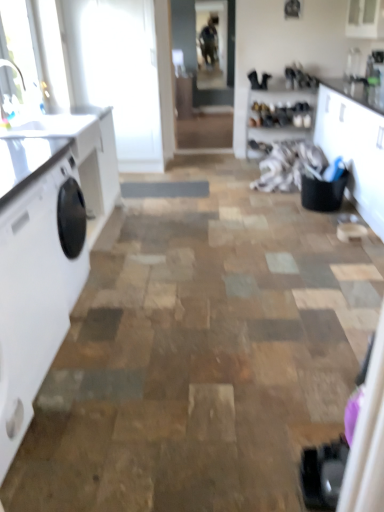
Question: From a real-world perspective, is white glossy countertop at left physically above clear glass window screen at upper center?

Choices:
 (A) yes
 (B) no

Answer: (B)

Question: Would you say clear glass window screen at upper center is part of white glossy countertop at left's contents?

Choices:
 (A) yes
 (B) no

Answer: (B)

Question: Is white glossy countertop at left turned away from clear glass window screen at upper center?

Choices:
 (A) yes
 (B) no

Answer: (B)

Question: Considering the relative positions of white glossy countertop at left and clear glass window screen at upper center in the image provided, is white glossy countertop at left behind clear glass window screen at upper center?

Choices:
 (A) yes
 (B) no

Answer: (B)

Question: Can you see white glossy countertop at left touching clear glass window screen at upper center?

Choices:
 (A) no
 (B) yes

Answer: (A)

Question: Is white glossy countertop at left not close to clear glass window screen at upper center?

Choices:
 (A) no
 (B) yes

Answer: (B)

Question: Does white glossy cabinet at right have a smaller size compared to white glossy washing machine at left?

Choices:
 (A) yes
 (B) no

Answer: (B)

Question: From the image's perspective, does white glossy cabinet at right appear higher than white glossy washing machine at left?

Choices:
 (A) no
 (B) yes

Answer: (B)

Question: Is white glossy washing machine at left inside white glossy cabinet at right?

Choices:
 (A) no
 (B) yes

Answer: (A)

Question: Would you consider white glossy cabinet at right to be distant from white glossy washing machine at left?

Choices:
 (A) yes
 (B) no

Answer: (A)

Question: Can you confirm if white glossy cabinet at right is shorter than white glossy washing machine at left?

Choices:
 (A) no
 (B) yes

Answer: (A)

Question: Is white glossy cabinet at right beside white glossy washing machine at left?

Choices:
 (A) no
 (B) yes

Answer: (A)

Question: Does white glossy countertop at left contain white glossy countertop at left?

Choices:
 (A) yes
 (B) no

Answer: (B)